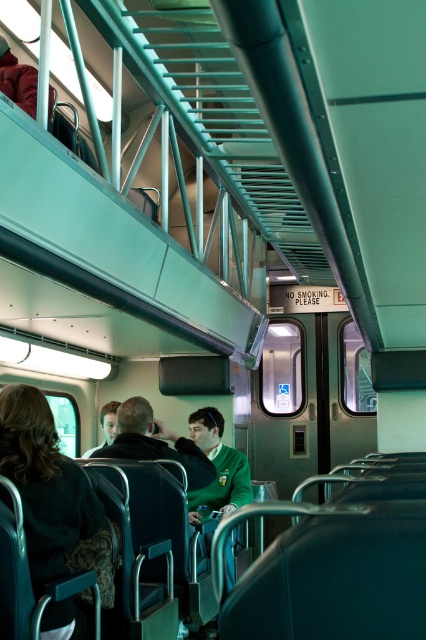
Question: Among these objects, which one is farthest from the camera?

Choices:
 (A) dark green sweater at lower left
 (B) green fabric jacket at center

Answer: (B)

Question: Which object appears farthest from the camera in this image?

Choices:
 (A) green fabric jacket at center
 (B) dark green sweater at lower left

Answer: (A)

Question: Is dark green sweater at lower left positioned in front of green fabric jacket at center?

Choices:
 (A) no
 (B) yes

Answer: (B)

Question: Which point appears closest to the camera in this image?

Choices:
 (A) (112, 420)
 (B) (54, 573)

Answer: (B)

Question: Does dark green sweater at lower left have a smaller size compared to green fabric jacket at center?

Choices:
 (A) no
 (B) yes

Answer: (A)

Question: Does dark green sweater at lower left appear on the right side of green fabric jacket at center?

Choices:
 (A) no
 (B) yes

Answer: (B)